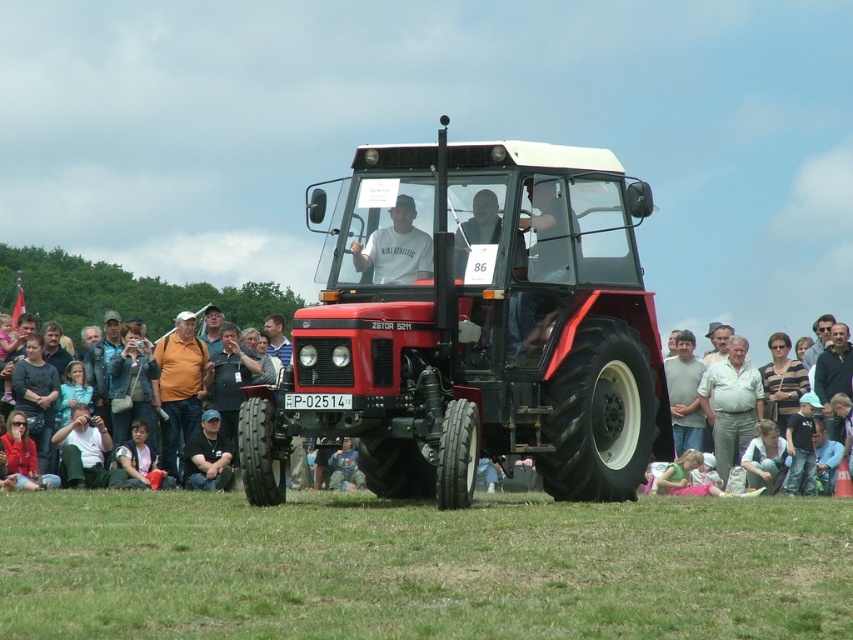
You are standing at the point labeled point [381,236] and want to walk towards the red Zetor 5211 tractor in the center. Is the point labeled point [561,627] located in front of you or behind you relative to your direction of movement?

The point labeled point [561,627] is in front of point [381,236]. So, as you walk towards the red Zetor 5211 tractor in the center, the point labeled point [561,627] will be in front of you relative to your direction of movement.